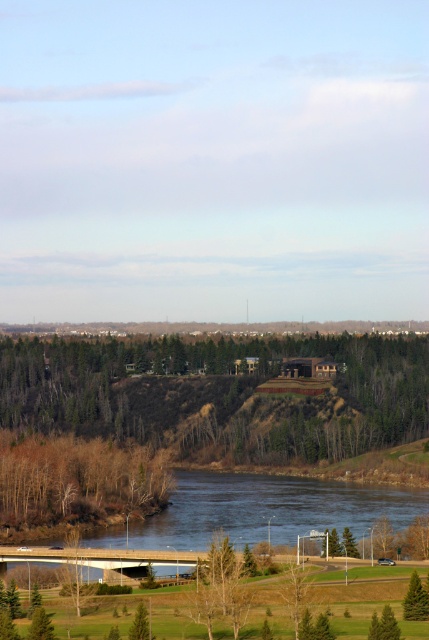
Question: Which of the following is the closest to the observer?

Choices:
 (A) brown/rocky river at lower center
 (B) green matte tree at lower right

Answer: (B)

Question: Which point is farther to the camera?

Choices:
 (A) (171, 545)
 (B) (132, 611)
 (C) (360, 388)
 (D) (142, 611)

Answer: (C)

Question: Is green matte tree at lower right further to camera compared to green matte tree at lower center?

Choices:
 (A) no
 (B) yes

Answer: (B)

Question: Observing the image, what is the correct spatial positioning of green leafy tree at center in reference to green matte tree at lower center?

Choices:
 (A) below
 (B) above

Answer: (B)

Question: Observing the image, what is the correct spatial positioning of green leafy tree at center in reference to green matte tree at lower right?

Choices:
 (A) right
 (B) left

Answer: (B)

Question: Which object appears closest to the camera in this image?

Choices:
 (A) green leafy tree at center
 (B) green grassy field at lower center
 (C) green matte tree at lower right
 (D) green matte tree at lower center

Answer: (D)